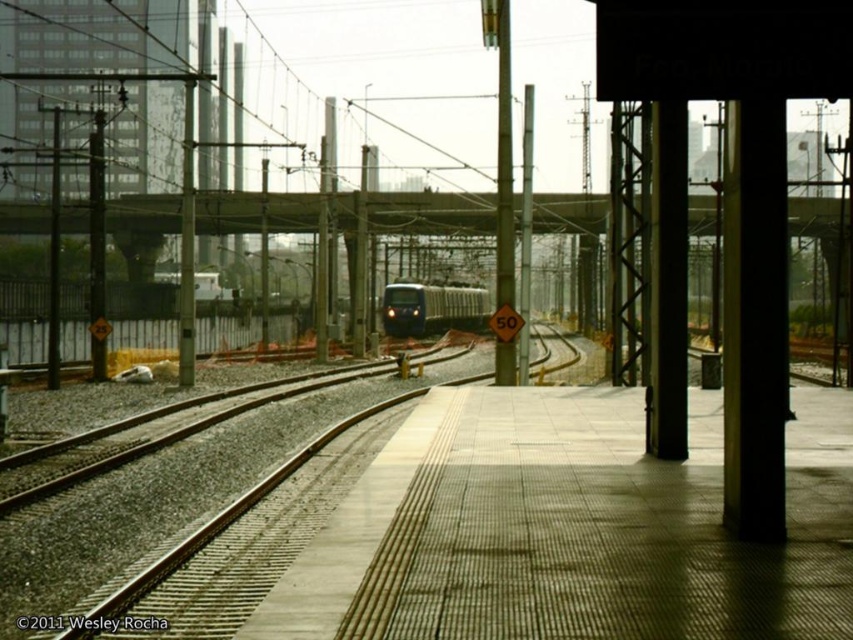
Question: Is smooth concrete train track at center positioned at the back of blue glossy train at center?

Choices:
 (A) yes
 (B) no

Answer: (B)

Question: Does smooth concrete train track at center have a lesser width compared to blue glossy train at center?

Choices:
 (A) no
 (B) yes

Answer: (A)

Question: Which point is farther to the camera?

Choices:
 (A) (392, 294)
 (B) (228, 538)

Answer: (A)

Question: Which point is closer to the camera?

Choices:
 (A) smooth concrete train track at center
 (B) blue glossy train at center

Answer: (A)

Question: Does smooth concrete train track at center come behind blue glossy train at center?

Choices:
 (A) no
 (B) yes

Answer: (A)